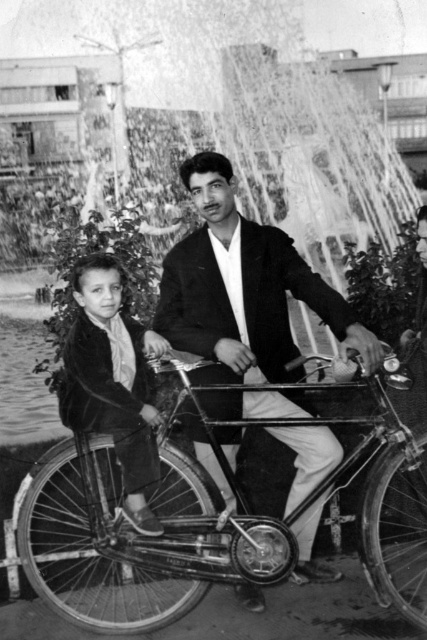
Who is positioned more to the right, smooth black jacket at center or velvet jacket at center?

smooth black jacket at center

Is smooth black jacket at center smaller than velvet jacket at center?

Incorrect, smooth black jacket at center is not smaller in size than velvet jacket at center.

Consider the image. Who is more distant from viewer, (294, 282) or (102, 372)?

Positioned behind is point (294, 282).

You are a GUI agent. You are given a task and a screenshot of the screen. Output one action in this format:
    pyautogui.click(x=<x>, y=<y>)
    Task: Click on the smooth black jacket at center
    
    Given the screenshot: What is the action you would take?
    pyautogui.click(x=242, y=289)

Who is higher up, metallic silver bicycle at center or smooth black jacket at center?

Positioned higher is smooth black jacket at center.

Find the location of a particular element. metallic silver bicycle at center is located at coordinates (139, 534).

The width and height of the screenshot is (427, 640). Describe the element at coordinates (139, 534) in the screenshot. I see `metallic silver bicycle at center` at that location.

Between metallic silver bicycle at center and velvet jacket at center, which one is positioned lower?

Positioned lower is metallic silver bicycle at center.

I want to click on metallic silver bicycle at center, so click(139, 534).